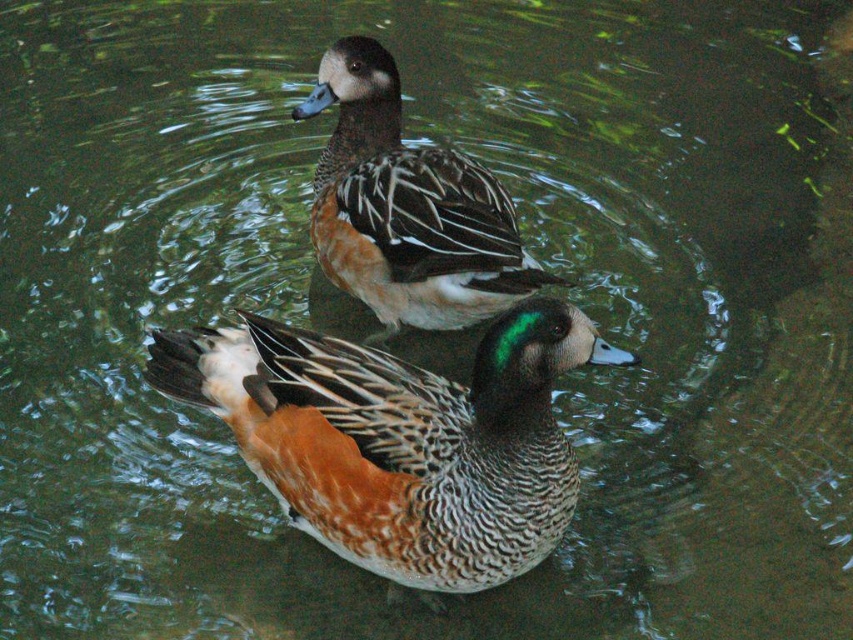
Question: In this image, where is speckled brown duck at center located relative to brown speckled duck at upper center?

Choices:
 (A) left
 (B) right

Answer: (A)

Question: Does speckled brown duck at center appear over brown speckled duck at upper center?

Choices:
 (A) yes
 (B) no

Answer: (B)

Question: Which of the following is the closest to the observer?

Choices:
 (A) (293, 493)
 (B) (340, 61)

Answer: (A)

Question: Is speckled brown duck at center closer to the viewer compared to brown speckled duck at upper center?

Choices:
 (A) yes
 (B) no

Answer: (A)